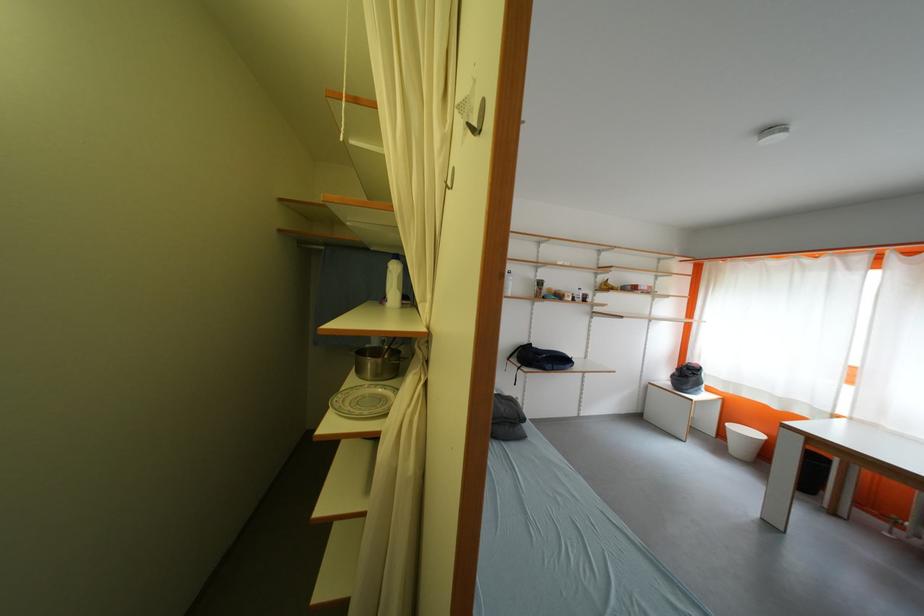
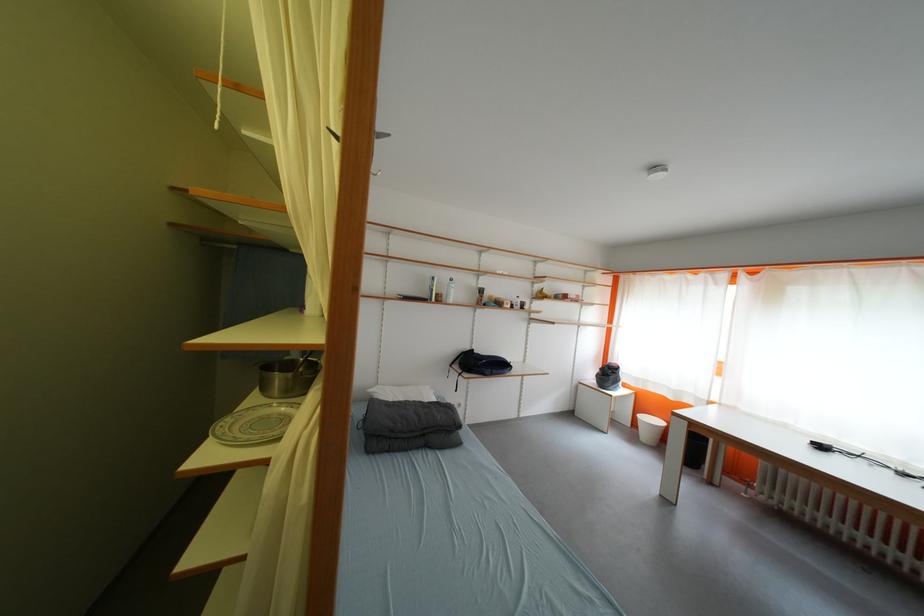
Where in the second image is the point corresponding to pixel 379 366 from the first image?

(286, 382)